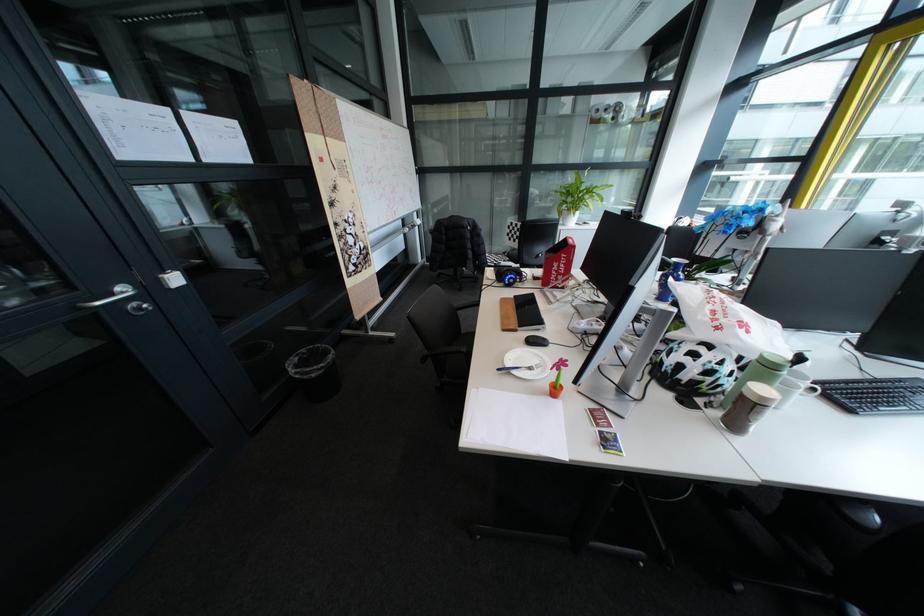
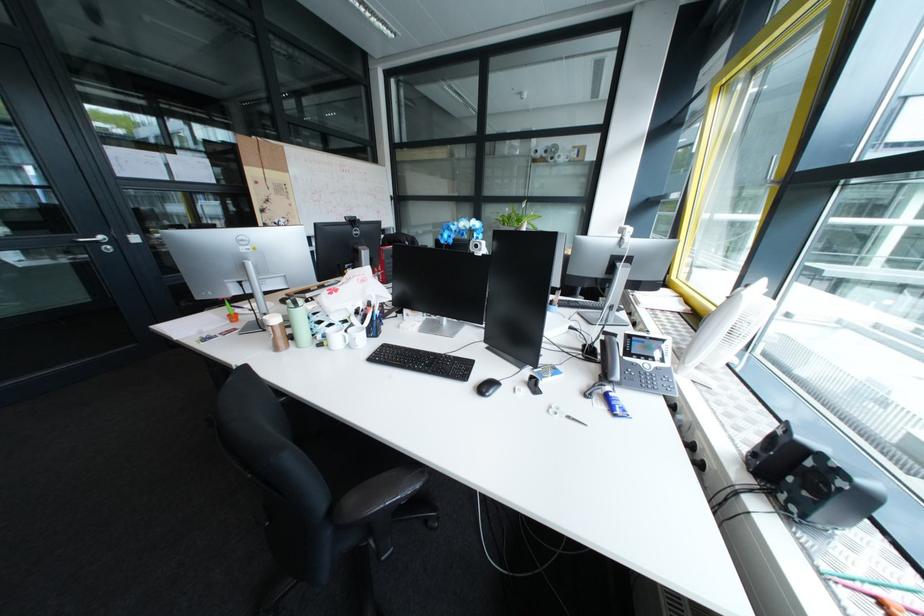
Question: I am providing you with two images of the same scene from different viewpoints. Please identify which objects are invisible in image2.

Choices:
 (A) black overhead projector
 (B) white handled scissors
 (C) white desk fan
 (D) blue headphones

Answer: (D)